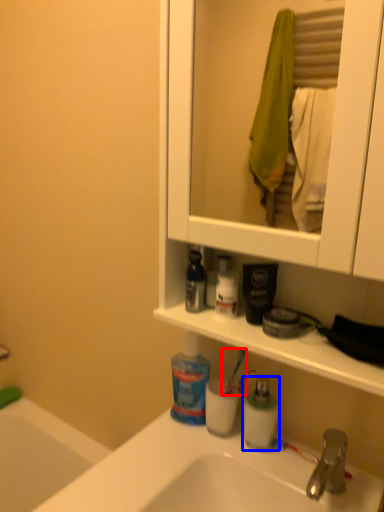
Question: Which object is further to the camera taking this photo, toothbrush (highlighted by a red box) or toiletry (highlighted by a blue box)?

Choices:
 (A) toothbrush
 (B) toiletry

Answer: (A)